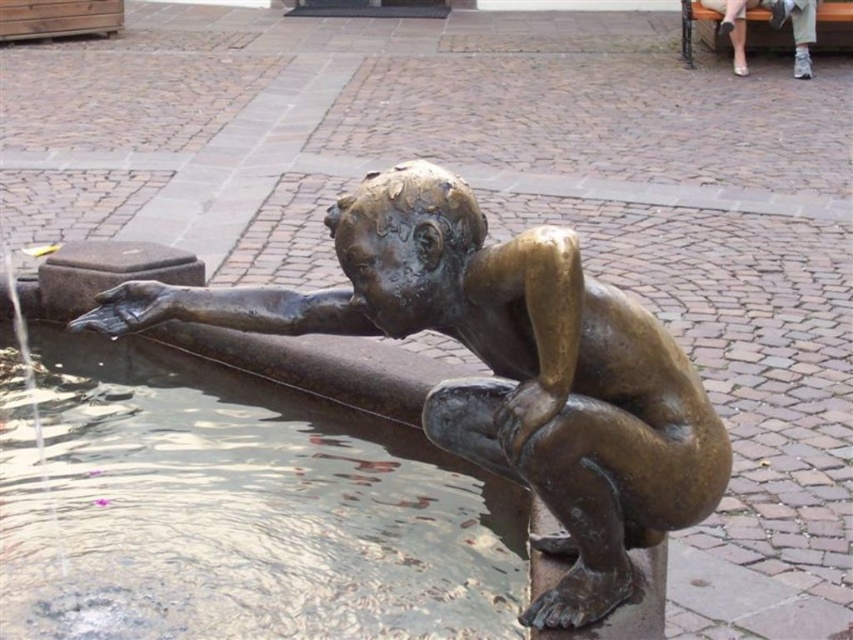
Consider the image. You are a photographer trying to capture the reflection of the metallic silver shoes at upper right in the clear water at statue center. Based on the scene description, will the reflection be fully visible in the water?

The clear water at statue center has a lesser height compared to metallic silver shoes at upper right, so the reflection of the metallic silver shoes at upper right may not be fully visible in the water because the water is shallower than the height of the shoes.

You are standing at the center of the fountain and want to reach the clear water at statue center. Which direction should you move to get there?

The clear water at statue center is located at point 0.800 on the x axis and 0.279 on the y axis. Since you are at the center of the fountain, you should move towards the right and slightly forward to reach the clear water at statue center.